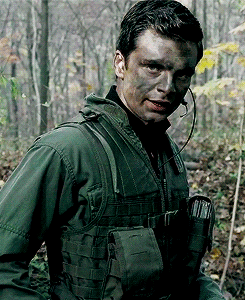
Where is `headset`? headset is located at coordinates (193, 111).